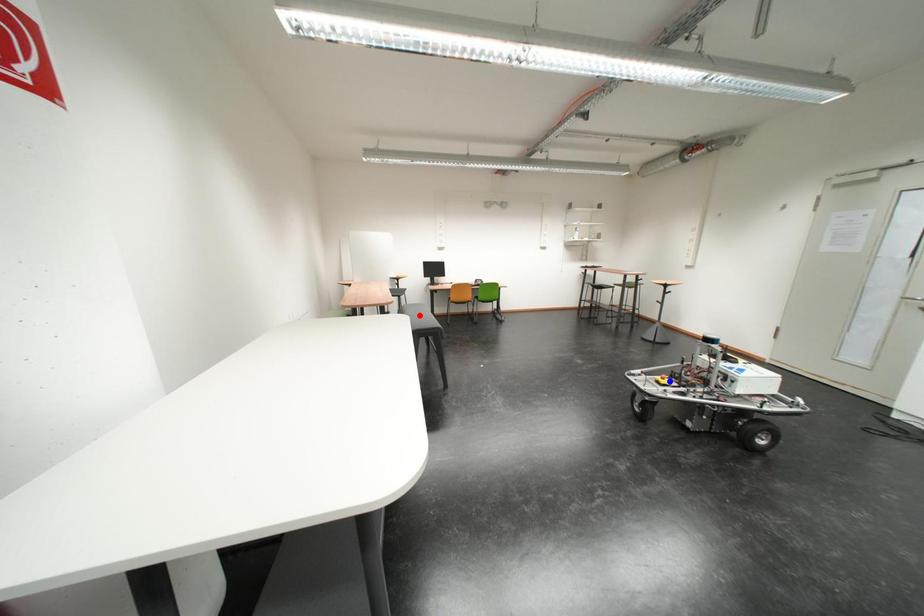
Question: Two points are marked on the image. Which point is closer to the camera?

Choices:
 (A) Blue point is closer.
 (B) Red point is closer.

Answer: (A)